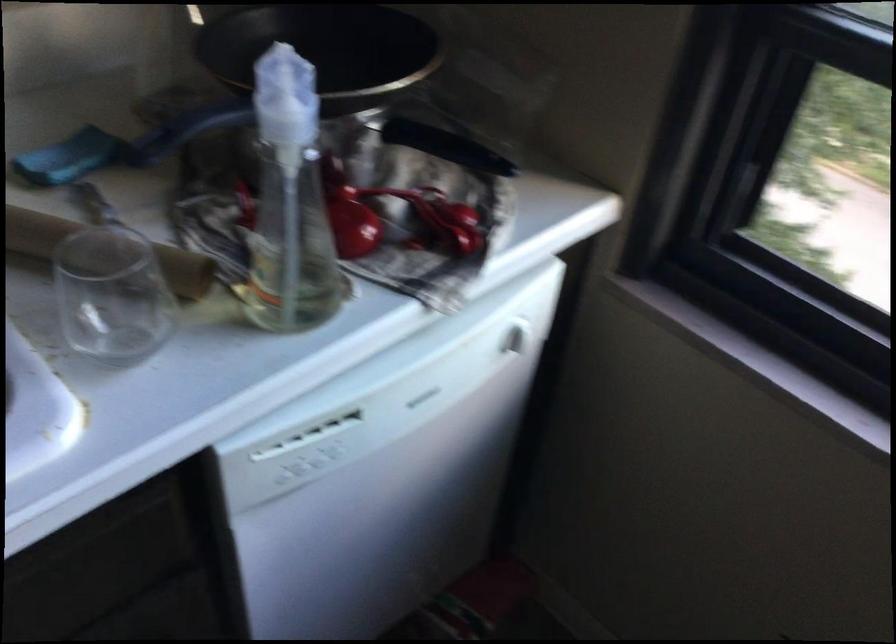
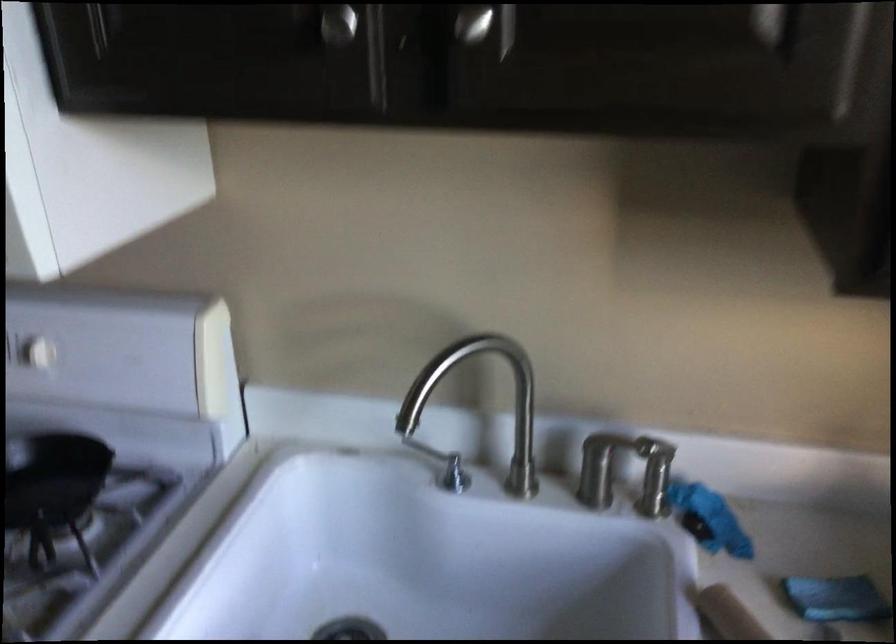
Question: The images are taken continuously from a first-person perspective. In which direction is your viewpoint rotating?

Choices:
 (A) Left
 (B) Right
 (C) Up
 (D) Down

Answer: (A)